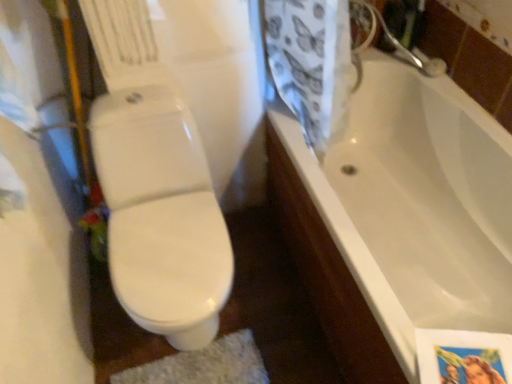
Question: From a real-world perspective, does white glossy bathtub at right sit lower than white glossy toilet at center?

Choices:
 (A) no
 (B) yes

Answer: (B)

Question: Is white glossy bathtub at right not close to white glossy toilet at center?

Choices:
 (A) yes
 (B) no

Answer: (B)

Question: Is white glossy bathtub at right taller than white glossy toilet at center?

Choices:
 (A) no
 (B) yes

Answer: (A)

Question: Would you say white glossy bathtub at right is outside white glossy toilet at center?

Choices:
 (A) yes
 (B) no

Answer: (A)

Question: From a real-world perspective, is white glossy bathtub at right located higher than white glossy toilet at center?

Choices:
 (A) no
 (B) yes

Answer: (A)

Question: Can you confirm if white glossy bathtub at right is smaller than white glossy toilet at center?

Choices:
 (A) yes
 (B) no

Answer: (B)

Question: Does white glossy toilet at center contain white glossy bathtub at right?

Choices:
 (A) no
 (B) yes

Answer: (A)

Question: Considering the relative sizes of white glossy toilet at center and white glossy bathtub at right in the image provided, is white glossy toilet at center smaller than white glossy bathtub at right?

Choices:
 (A) yes
 (B) no

Answer: (A)

Question: Does white glossy toilet at center have a lesser height compared to white glossy bathtub at right?

Choices:
 (A) no
 (B) yes

Answer: (A)

Question: Does white glossy toilet at center have a lesser width compared to white glossy bathtub at right?

Choices:
 (A) no
 (B) yes

Answer: (B)

Question: Is white glossy toilet at center placed right next to white glossy bathtub at right?

Choices:
 (A) no
 (B) yes

Answer: (A)

Question: Considering the relative sizes of white glossy toilet at center and white glossy bathtub at right in the image provided, is white glossy toilet at center bigger than white glossy bathtub at right?

Choices:
 (A) no
 (B) yes

Answer: (A)

Question: From a real-world perspective, is white glossy bathtub at right positioned above or below white glossy toilet at center?

Choices:
 (A) above
 (B) below

Answer: (B)